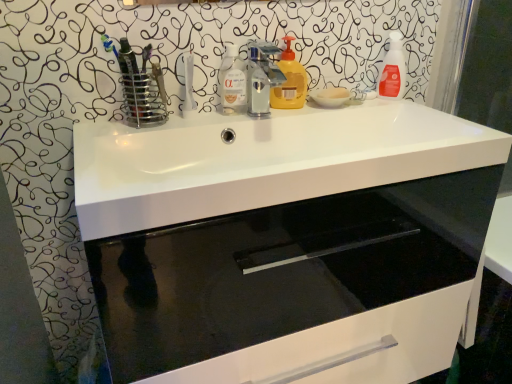
Find the location of a particular element. The image size is (512, 384). vacant area to the left of metallic silver faucet at center is located at coordinates (203, 115).